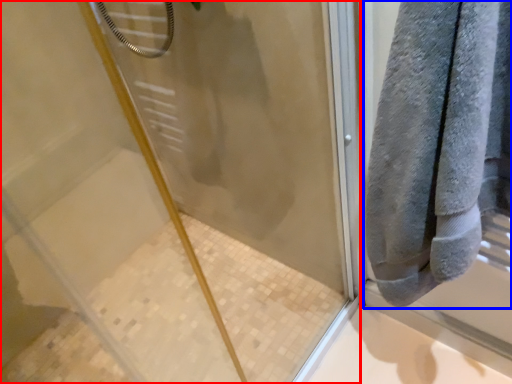
Question: Which object appears farthest to the camera in this image, screen door (highlighted by a red box) or towel (highlighted by a blue box)?

Choices:
 (A) screen door
 (B) towel

Answer: (B)